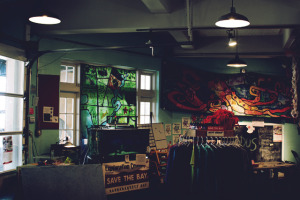
The width and height of the screenshot is (300, 200). What are the coordinates of `picture on wall` in the screenshot? It's located at (240, 99).